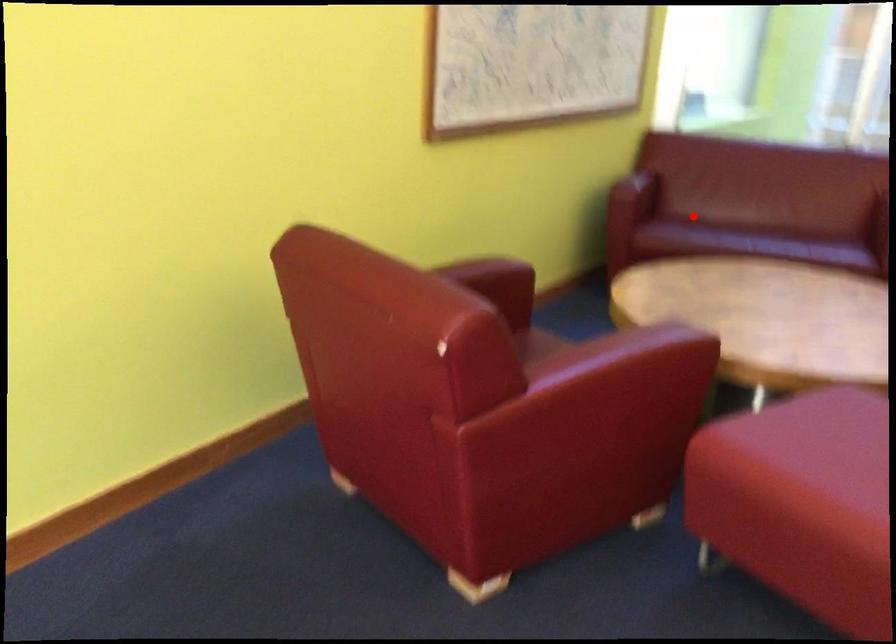
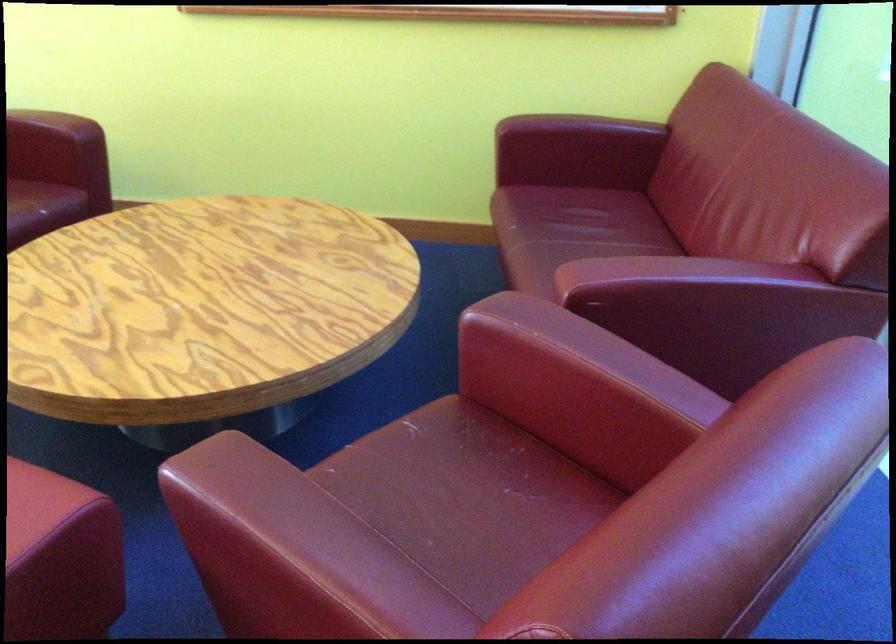
Find the pixel in the second image that matches the highlighted location in the first image.

(592, 210)